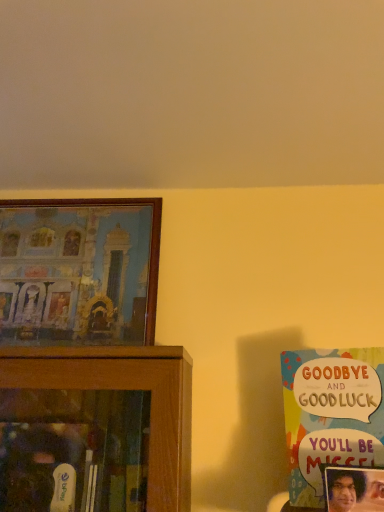
Question: From a real-world perspective, relative to matte plastic picture frame at lower right, which appears as the first picture frame when viewed from the front, is wooden framed painting at left, marked as the second picture frame in a front-to-back arrangement, vertically above or below?

Choices:
 (A) above
 (B) below

Answer: (A)

Question: From the image's perspective, is wooden framed painting at left, which is the 1th picture frame in back-to-front order, above or below matte plastic picture frame at lower right, positioned as the second picture frame in back-to-front order?

Choices:
 (A) below
 (B) above

Answer: (B)

Question: Which object is the closest to the multicolored paper card at right?

Choices:
 (A) matte plastic picture frame at lower right, arranged as the 2th picture frame when viewed from the top
 (B) wooden framed painting at left, the 2th picture frame from the right

Answer: (A)

Question: Estimate the real-world distances between objects in this image. Which object is farther from the matte plastic picture frame at lower right, the 2th picture frame in the left-to-right sequence?

Choices:
 (A) wooden framed painting at left, marked as the second picture frame in a front-to-back arrangement
 (B) multicolored paper card at right

Answer: (A)